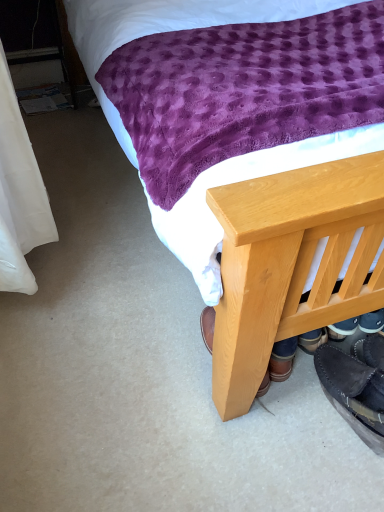
Question: Is black suede moccasin at lower right, which appears as the 2th footwear when viewed from the right, positioned before black suede shoes at lower right, which is the 1th footwear in right-to-left order?

Choices:
 (A) no
 (B) yes

Answer: (A)

Question: Considering the relative sizes of black suede moccasin at lower right, which is the 1th footwear in left-to-right order, and black suede shoes at lower right, acting as the 2th footwear starting from the left, in the image provided, is black suede moccasin at lower right, which is the 1th footwear in left-to-right order, wider than black suede shoes at lower right, acting as the 2th footwear starting from the left,?

Choices:
 (A) no
 (B) yes

Answer: (A)

Question: Is black suede moccasin at lower right, which appears as the 2th footwear when viewed from the right, positioned far away from black suede shoes at lower right, which is the 1th footwear in right-to-left order?

Choices:
 (A) yes
 (B) no

Answer: (B)

Question: From the image's perspective, does black suede moccasin at lower right, which appears as the 2th footwear when viewed from the right, appear higher than black suede shoes at lower right, acting as the 2th footwear starting from the left?

Choices:
 (A) no
 (B) yes

Answer: (A)

Question: Is black suede moccasin at lower right, which appears as the 2th footwear when viewed from the right, touching black suede shoes at lower right, which is the 1th footwear in right-to-left order?

Choices:
 (A) no
 (B) yes

Answer: (B)

Question: Is point (357, 389) closer or farther from the camera than point (198, 193)?

Choices:
 (A) farther
 (B) closer

Answer: (A)

Question: Would you say black suede moccasin at lower right, which is the 1th footwear in left-to-right order, is inside or outside wooden bed frame at lower right?

Choices:
 (A) inside
 (B) outside

Answer: (A)

Question: Considering their positions, is black suede moccasin at lower right, which appears as the 2th footwear when viewed from the right, located in front of or behind wooden bed frame at lower right?

Choices:
 (A) behind
 (B) front

Answer: (A)

Question: From the image's perspective, relative to wooden bed frame at lower right, is black suede moccasin at lower right, which appears as the 2th footwear when viewed from the right, above or below?

Choices:
 (A) above
 (B) below

Answer: (B)

Question: Is black suede moccasin at lower right, which is the 1th footwear in left-to-right order, inside or outside of black suede shoes at lower right, which is the 1th footwear in right-to-left order?

Choices:
 (A) inside
 (B) outside

Answer: (B)

Question: From the image's perspective, is black suede moccasin at lower right, which appears as the 2th footwear when viewed from the right, located above or below black suede shoes at lower right, which is the 1th footwear in right-to-left order?

Choices:
 (A) below
 (B) above

Answer: (A)

Question: Is black suede moccasin at lower right, which appears as the 2th footwear when viewed from the right, bigger or smaller than black suede shoes at lower right, which is the 1th footwear in right-to-left order?

Choices:
 (A) small
 (B) big

Answer: (B)

Question: Is black suede moccasin at lower right, which is the 1th footwear in left-to-right order, wider or thinner than black suede shoes at lower right, which is the 1th footwear in right-to-left order?

Choices:
 (A) wide
 (B) thin

Answer: (B)

Question: In terms of width, does wooden bed frame at lower right look wider or thinner when compared to black suede shoes at lower right, which is the 1th footwear in right-to-left order?

Choices:
 (A) wide
 (B) thin

Answer: (A)

Question: Based on their sizes in the image, would you say wooden bed frame at lower right is bigger or smaller than black suede shoes at lower right, acting as the 2th footwear starting from the left?

Choices:
 (A) small
 (B) big

Answer: (B)